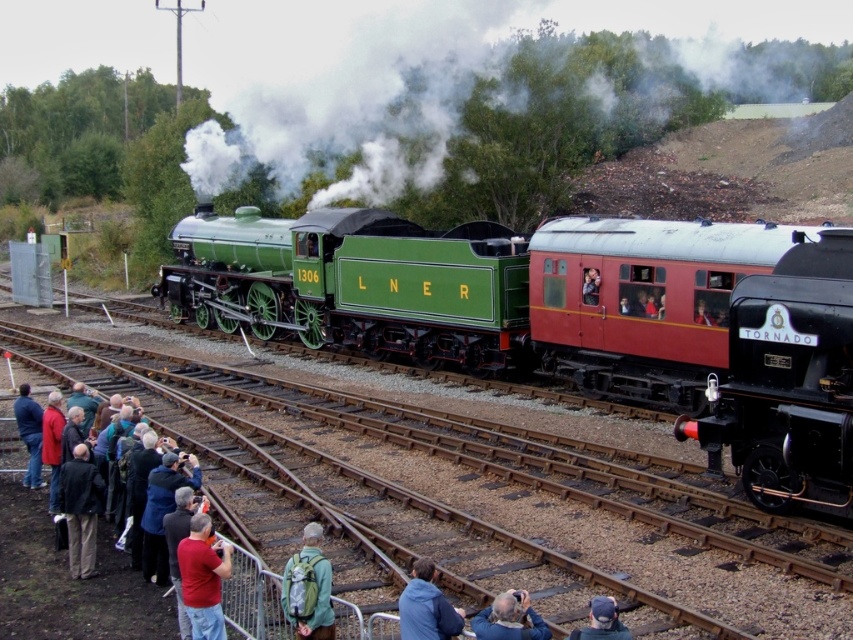
Question: From the image, what is the correct spatial relationship of polished black steam locomotive at right in relation to dark blue cap at lower center?

Choices:
 (A) below
 (B) above

Answer: (B)

Question: Which point is closer to the camera taking this photo?

Choices:
 (A) (430, 612)
 (B) (746, 356)

Answer: (A)

Question: Can you confirm if red cotton shirt at lower left is thinner than blue fabric jacket at lower center?

Choices:
 (A) no
 (B) yes

Answer: (B)

Question: Which object is farther from the camera taking this photo?

Choices:
 (A) polished black steam locomotive at right
 (B) green polished wood train at center
 (C) white vapor steam at upper center

Answer: (C)

Question: Considering the real-world distances, which object is closest to the red cotton shirt at lower left?

Choices:
 (A) blue denim jacket at lower center
 (B) dark gray jacket at lower left

Answer: (A)

Question: Is dark gray clothing at lower left positioned in front of red jacket at lower left?

Choices:
 (A) yes
 (B) no

Answer: (A)